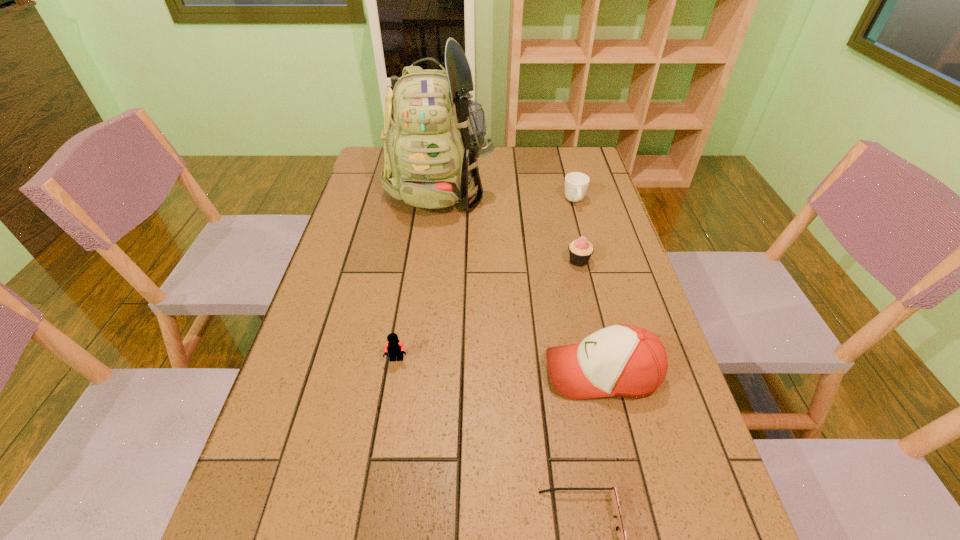
The width and height of the screenshot is (960, 540). Identify the location of vacant position at the right edge of the desktop. (615, 291).

In the image, there is a desktop. Find the location of `blank space at the far left corner`. blank space at the far left corner is located at coordinates (372, 162).

Identify the location of vacant area at the far right corner of the desktop. Image resolution: width=960 pixels, height=540 pixels. (591, 177).

Find the location of a particular element. empty space between the second tallest object and the cupcake is located at coordinates (590, 316).

You are a GUI agent. You are given a task and a screenshot of the screen. Output one action in this format:
    pyautogui.click(x=<x>, y=<y>)
    Task: Click on the free space between the fourth nearest object and the tallest object
    
    Given the screenshot: What is the action you would take?
    [x=510, y=224]

Locate an element on the screen. This screenshot has height=540, width=960. blank region between the baseball cap and the cup is located at coordinates (588, 287).

Find the location of a particular element. The width and height of the screenshot is (960, 540). blank region between the Lego and the backpack is located at coordinates (419, 273).

Locate an element on the screen. This screenshot has width=960, height=540. unoccupied area between the fourth nearest object and the tallest object is located at coordinates (510, 224).

Identify which object is the second closest to the third farthest object. Please provide its 2D coordinates. Your answer should be formatted as a tuple, i.e. [(x, y)], where the tuple contains the x and y coordinates of a point satisfying the conditions above.

[(433, 135)]

Locate which object is the closest to the baseball cap. Please provide its 2D coordinates. Your answer should be formatted as a tuple, i.e. [(x, y)], where the tuple contains the x and y coordinates of a point satisfying the conditions above.

[(614, 497)]